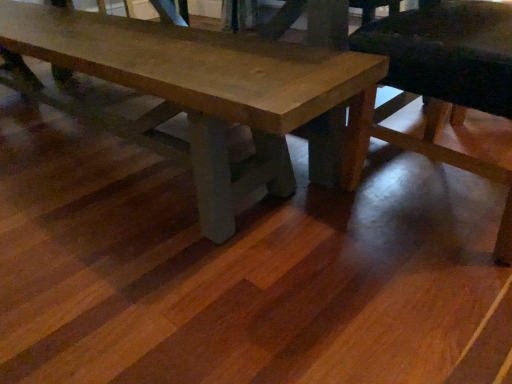
Question: In terms of size, does wooden table at center appear bigger or smaller than wooden chair at lower right?

Choices:
 (A) small
 (B) big

Answer: (B)

Question: Is point (230, 183) positioned closer to the camera than point (448, 14)?

Choices:
 (A) farther
 (B) closer

Answer: (A)

Question: From the image's perspective, is wooden table at center located above or below wooden chair at lower right?

Choices:
 (A) above
 (B) below

Answer: (A)

Question: Is wooden chair at lower right in front of or behind wooden table at center in the image?

Choices:
 (A) behind
 (B) front

Answer: (B)

Question: From the image's perspective, is wooden chair at lower right positioned above or below wooden table at center?

Choices:
 (A) below
 (B) above

Answer: (A)

Question: Considering the positions of wooden chair at lower right and wooden table at center in the image, is wooden chair at lower right wider or thinner than wooden table at center?

Choices:
 (A) thin
 (B) wide

Answer: (B)

Question: Is wooden chair at lower right situated inside wooden table at center or outside?

Choices:
 (A) inside
 (B) outside

Answer: (B)